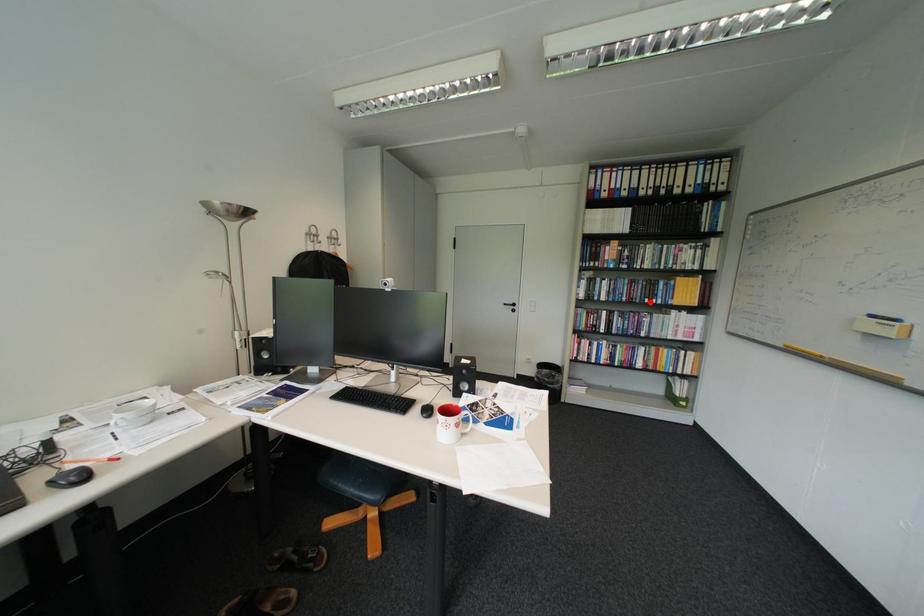
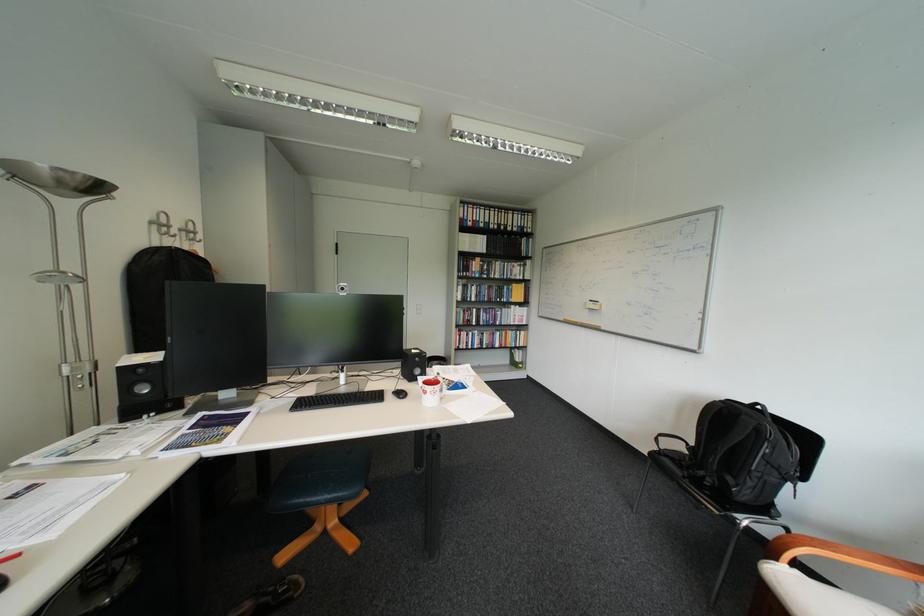
The point at the highlighted location is marked in the first image. Where is the corresponding point in the second image?

(505, 301)